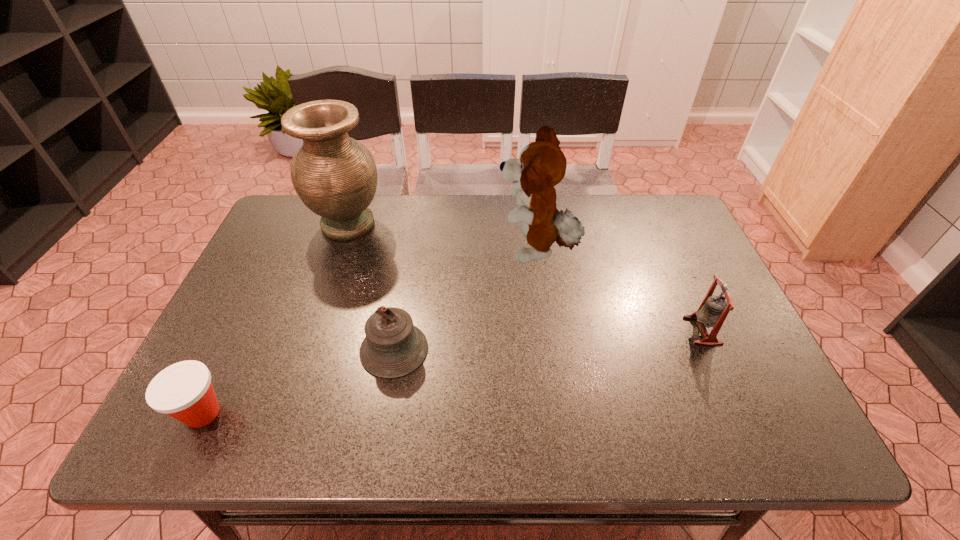
This screenshot has height=540, width=960. In order to click on vacant point located between the right bell and the nearest object in this screenshot , I will do `click(453, 372)`.

Identify the location of free point between the puppy and the third object from left to right. The width and height of the screenshot is (960, 540). (466, 301).

You are a GUI agent. You are given a task and a screenshot of the screen. Output one action in this format:
    pyautogui.click(x=<x>, y=<y>)
    Task: Click on the free space between the puppy and the vase
    This screenshot has height=540, width=960.
    Given the screenshot: What is the action you would take?
    pyautogui.click(x=443, y=238)

Choose which object is the second nearest neighbor to the right bell. Please provide its 2D coordinates. Your answer should be formatted as a tuple, i.e. [(x, y)], where the tuple contains the x and y coordinates of a point satisfying the conditions above.

[(393, 347)]

Point out which object is positioned as the nearest to the second object from right to left. Please provide its 2D coordinates. Your answer should be formatted as a tuple, i.e. [(x, y)], where the tuple contains the x and y coordinates of a point satisfying the conditions above.

[(393, 347)]

I want to click on free space that satisfies the following two spatial constraints: 1. on the face of the second object from right to left; 2. on the front side of the Dixie cup, so click(559, 413).

This screenshot has width=960, height=540. In order to click on vacant position in the image that satisfies the following two spatial constraints: 1. on the face of the right bell; 2. on the right side of the puppy in this screenshot , I will do `click(547, 330)`.

Where is `free space that satisfies the following two spatial constraints: 1. on the face of the fourth object from left to right; 2. on the front side of the left bell`? The height and width of the screenshot is (540, 960). free space that satisfies the following two spatial constraints: 1. on the face of the fourth object from left to right; 2. on the front side of the left bell is located at coordinates (550, 349).